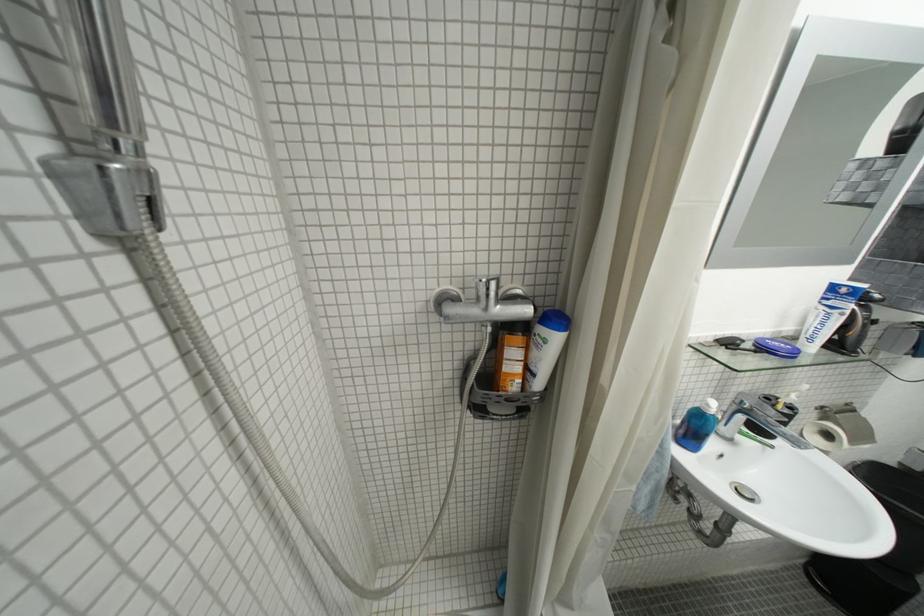
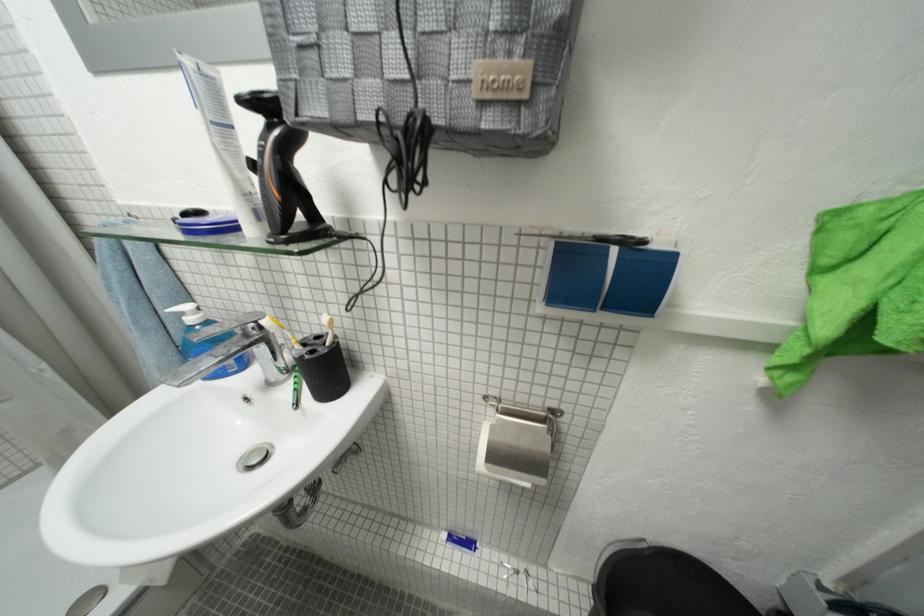
Question: The images are taken continuously from a first-person perspective. In which direction are you moving?

Choices:
 (A) Left
 (B) Right
 (C) Forward
 (D) Backward

Answer: (B)